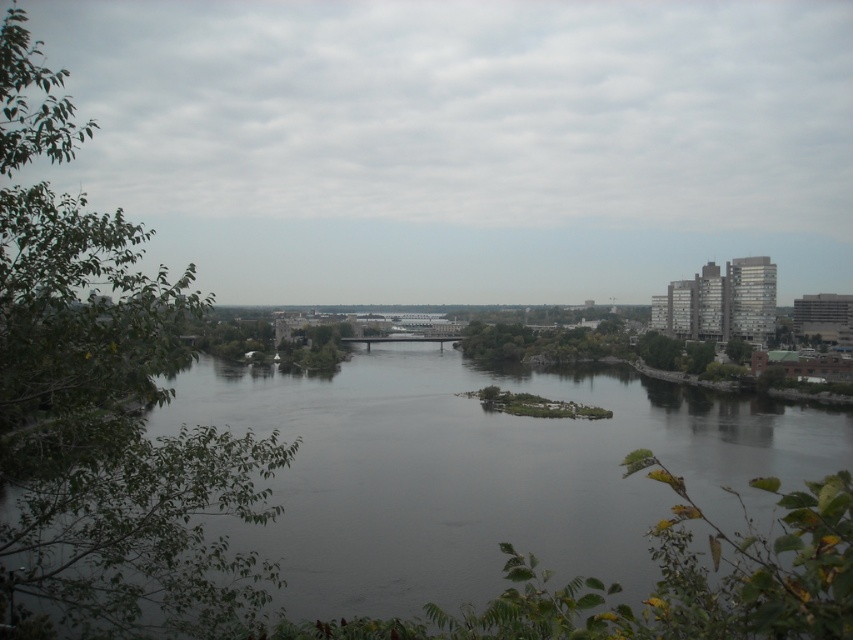
You are standing on the riverside path and want to take a photo of the dark gray water at center and the green leafy tree at left. Which object will appear larger in your photo?

The dark gray water at center will appear larger in the photo because it is closer to the viewer than the green leafy tree at left.

You are an environmental scientist analyzing the riverside area. You need to determine which object in the scene occupies a larger area. Based on the image, which one is bigger between the dark gray water at center and the green leafy tree at left?

The green leafy tree at left is larger in size than the dark gray water at center.

You are a photographer planning to capture the entire riverside scene in one shot. Given that your camera can only focus on objects within a 10m width, which object between the dark gray water at center and the green leafy tree at left would require careful framing to ensure it fits entirely within the frame?

The dark gray water at center has a greater width than the green leafy tree at left, so it would require careful framing to ensure it fits within the 10m width constraint.